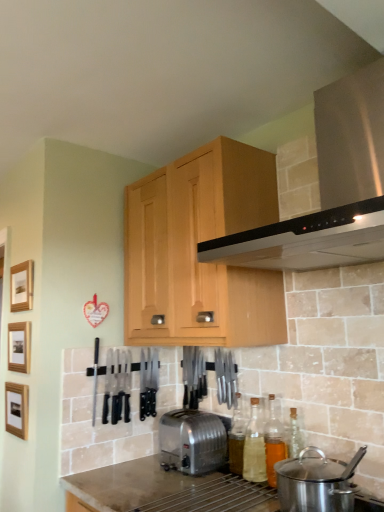
Question: Is the position of translucent glass bottle at center, the first bottle in the left-to-right sequence, more distant than that of stainless steel range hood at upper center?

Choices:
 (A) yes
 (B) no

Answer: (A)

Question: Does translucent glass bottle at center, the first bottle in the left-to-right sequence, lie in front of stainless steel range hood at upper center?

Choices:
 (A) no
 (B) yes

Answer: (A)

Question: Does translucent glass bottle at center, which is the third bottle from right to left, have a lesser width compared to stainless steel range hood at upper center?

Choices:
 (A) yes
 (B) no

Answer: (A)

Question: From the image's perspective, is translucent glass bottle at center, which is the third bottle from right to left, located above stainless steel range hood at upper center?

Choices:
 (A) yes
 (B) no

Answer: (B)

Question: Is translucent glass bottle at center, which is the third bottle from right to left, wider than stainless steel range hood at upper center?

Choices:
 (A) yes
 (B) no

Answer: (B)

Question: Is there a large distance between translucent glass bottle at center, which is the third bottle from right to left, and stainless steel range hood at upper center?

Choices:
 (A) yes
 (B) no

Answer: (B)

Question: Is translucent glass bottle at center, which is the third bottle from right to left, inside light wood cabinet at upper center?

Choices:
 (A) no
 (B) yes

Answer: (A)

Question: Is light wood cabinet at upper center far from translucent glass bottle at center, which is the third bottle from right to left?

Choices:
 (A) no
 (B) yes

Answer: (A)

Question: Is light wood cabinet at upper center to the right of translucent glass bottle at center, the first bottle in the left-to-right sequence, from the viewer's perspective?

Choices:
 (A) yes
 (B) no

Answer: (B)

Question: Does light wood cabinet at upper center have a lesser height compared to translucent glass bottle at center, which is the third bottle from right to left?

Choices:
 (A) yes
 (B) no

Answer: (B)

Question: Considering the relative sizes of light wood cabinet at upper center and translucent glass bottle at center, which is the third bottle from right to left, in the image provided, is light wood cabinet at upper center smaller than translucent glass bottle at center, which is the third bottle from right to left,?

Choices:
 (A) no
 (B) yes

Answer: (A)

Question: From a real-world perspective, does light wood cabinet at upper center sit lower than translucent glass bottle at center, which is the third bottle from right to left?

Choices:
 (A) yes
 (B) no

Answer: (B)

Question: From the image's perspective, is wooden picture frame at left, the 1th picture frame ordered from the bottom, below wooden picture frame at left, which ranks as the second picture frame in bottom-to-top order?

Choices:
 (A) no
 (B) yes

Answer: (B)